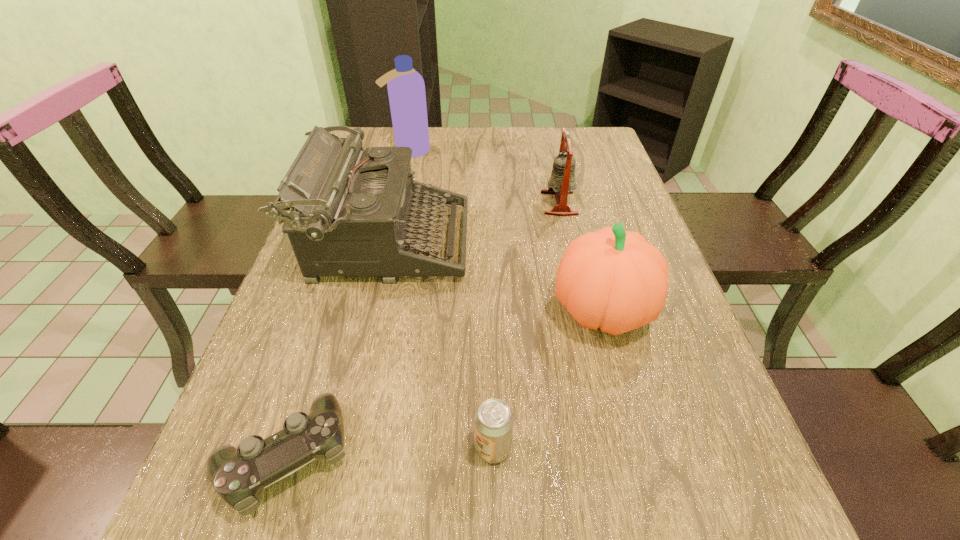
In the image, there is a desktop. At what (x,y) coordinates should I click in order to perform the action: click on vacant region at the far edge. Please return your answer as a coordinate pair (x, y). Looking at the image, I should click on (443, 136).

The image size is (960, 540). Find the location of `free region at the right edge of the desktop`. free region at the right edge of the desktop is located at coordinates (607, 220).

Where is `vacant space at the far right corner`? This screenshot has width=960, height=540. vacant space at the far right corner is located at coordinates (590, 127).

The width and height of the screenshot is (960, 540). In order to click on free space between the bell and the fifth tallest object in this screenshot , I will do pyautogui.click(x=526, y=326).

The image size is (960, 540). Find the location of `empty space between the bell and the beer can`. empty space between the bell and the beer can is located at coordinates (526, 326).

Locate an element on the screen. This screenshot has width=960, height=540. unoccupied area between the pumpkin and the typewriter is located at coordinates (495, 276).

What are the coordinates of `free point between the typewriter and the bell` in the screenshot? It's located at (473, 223).

The height and width of the screenshot is (540, 960). I want to click on free spot between the shampoo and the pumpkin, so click(x=506, y=231).

Where is `empty space that is in between the beer can and the pumpkin`? This screenshot has width=960, height=540. empty space that is in between the beer can and the pumpkin is located at coordinates (547, 379).

At what (x,y) coordinates should I click in order to perform the action: click on unoccupied position between the beer can and the shampoo. Please return your answer as a coordinate pair (x, y). This screenshot has width=960, height=540. Looking at the image, I should click on (451, 299).